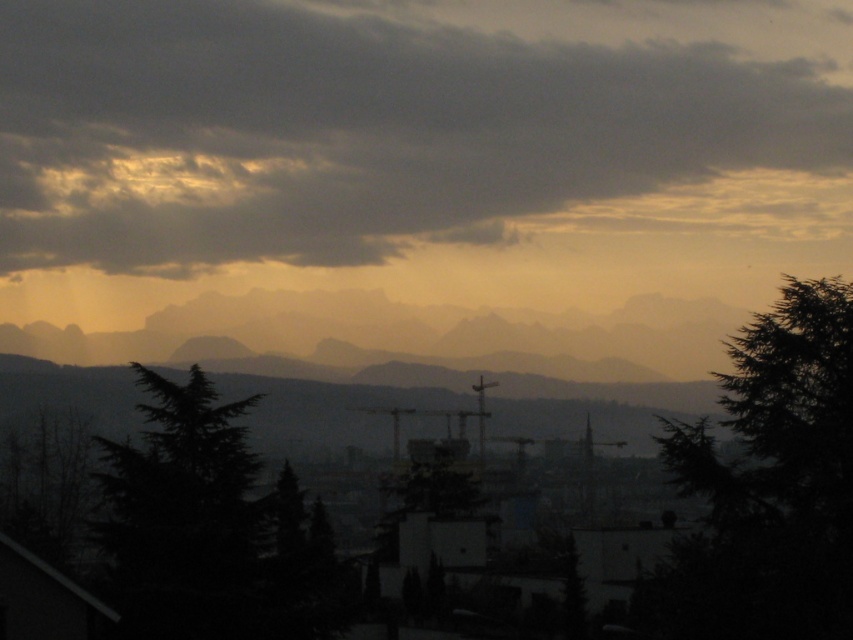
Question: Which point appears closest to the camera in this image?

Choices:
 (A) (796, 465)
 (B) (289, 124)

Answer: (A)

Question: Is dark gray textured cloud at upper center to the right of green textured tree at right from the viewer's perspective?

Choices:
 (A) no
 (B) yes

Answer: (A)

Question: Can you confirm if dark gray textured cloud at upper center is positioned to the right of green textured tree at right?

Choices:
 (A) no
 (B) yes

Answer: (A)

Question: Among these points, which one is nearest to the camera?

Choices:
 (A) click(x=848, y=600)
 (B) click(x=544, y=120)

Answer: (A)

Question: Can you confirm if dark gray textured cloud at upper center is positioned above green textured tree at right?

Choices:
 (A) yes
 (B) no

Answer: (A)